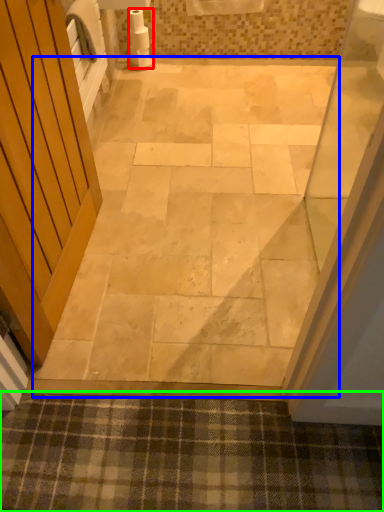
Question: Estimate the real-world distances between objects in this image. Which object is closer to toilet paper (highlighted by a red box), path (highlighted by a blue box) or bath mat (highlighted by a green box)?

Choices:
 (A) path
 (B) bath mat

Answer: (A)